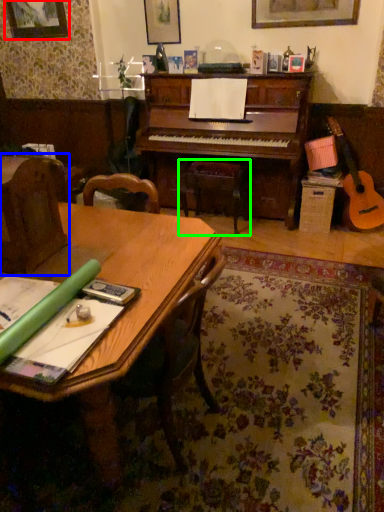
Question: Considering the real-world distances, which object is farthest from picture frame (highlighted by a red box)? armchair (highlighted by a blue box) or music stool (highlighted by a green box)?

Choices:
 (A) armchair
 (B) music stool

Answer: (A)